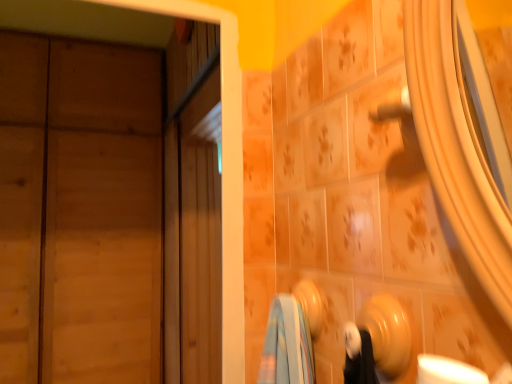
The height and width of the screenshot is (384, 512). What do you see at coordinates (80, 211) in the screenshot? I see `wooden door at left` at bounding box center [80, 211].

Looking at this image, what is the approximate height of wooden door at left?

The height of wooden door at left is 6.38 feet.

Identify the location of wooden door at left. This screenshot has height=384, width=512. (80, 211).

Find the location of a particular element. This screenshot has width=512, height=384. wooden door at left is located at coordinates (80, 211).